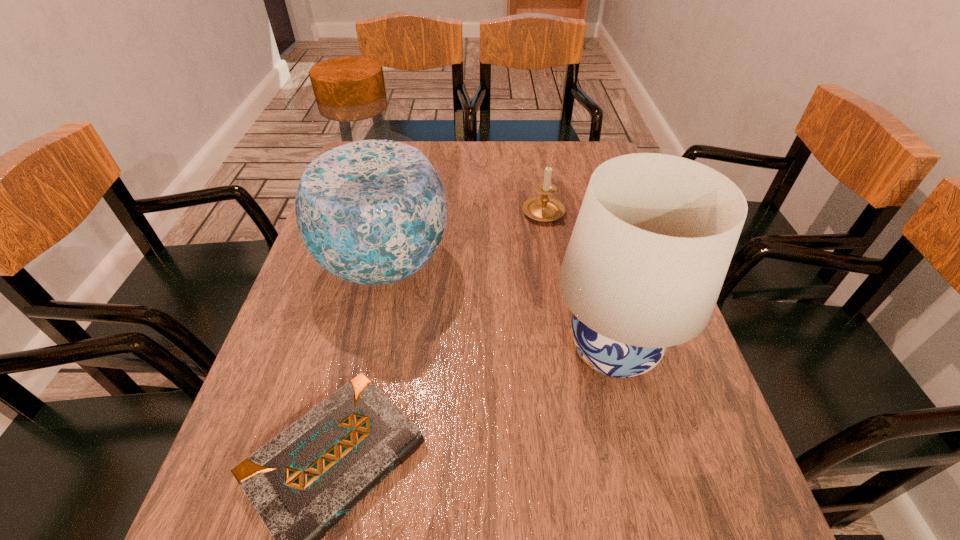
You are a GUI agent. You are given a task and a screenshot of the screen. Output one action in this format:
    pyautogui.click(x=<x>, y=<y>)
    Task: Click on the object present at the left edge
    The image size is (960, 540).
    Given the screenshot: What is the action you would take?
    pyautogui.click(x=370, y=207)

Where is `object at the right edge`? The width and height of the screenshot is (960, 540). object at the right edge is located at coordinates (655, 234).

The width and height of the screenshot is (960, 540). What are the coordinates of `free point at the far edge` in the screenshot? It's located at (466, 159).

This screenshot has width=960, height=540. In the image, there is a desktop. Find the location of `vacant space at the near edge`. vacant space at the near edge is located at coordinates (422, 539).

Locate an element on the screen. This screenshot has width=960, height=540. free space at the left edge of the desktop is located at coordinates (279, 351).

You are a GUI agent. You are given a task and a screenshot of the screen. Output one action in this format:
    pyautogui.click(x=<x>, y=<y>)
    Task: Click on the blank space at the right edge of the desktop
    The image size is (960, 540).
    Given the screenshot: What is the action you would take?
    pyautogui.click(x=736, y=479)

Identify the location of free space at the far right corner. (582, 142).

Where is `vacant region at the near right corner`? This screenshot has height=540, width=960. vacant region at the near right corner is located at coordinates (660, 534).

Locate an element on the screen. Image resolution: width=960 pixels, height=540 pixels. vacant space that's between the water jug and the third tallest object is located at coordinates (464, 237).

Where is `vacant point located between the lampshade and the tallest object`? The image size is (960, 540). vacant point located between the lampshade and the tallest object is located at coordinates (498, 307).